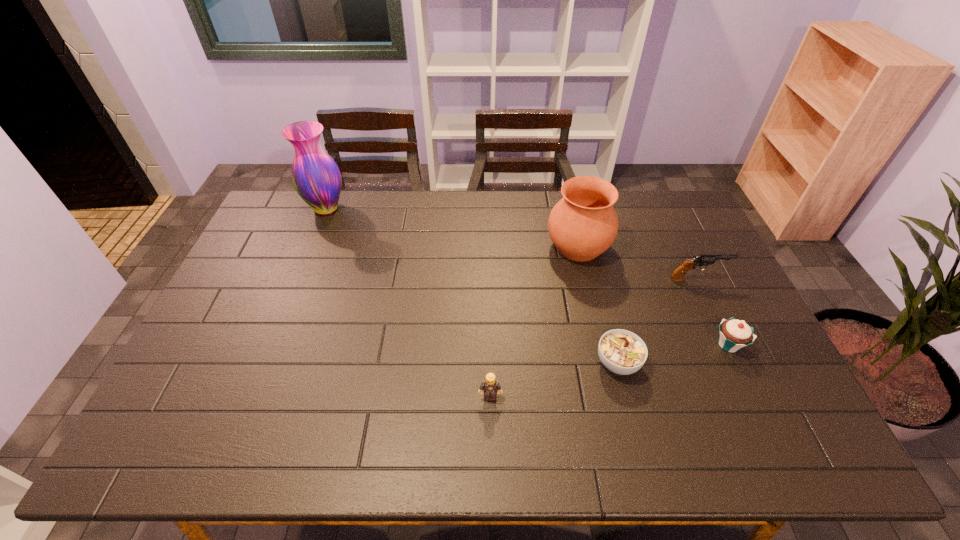
The width and height of the screenshot is (960, 540). What are the coordinates of `empty space that is in between the Lego and the cupcake` in the screenshot? It's located at (610, 370).

The image size is (960, 540). Identify the location of free space between the shortest object and the farthest object. (471, 286).

You are a GUI agent. You are given a task and a screenshot of the screen. Output one action in this format:
    pyautogui.click(x=<x>, y=<y>)
    Task: Click on the vacant space that is in between the tallest object and the gun
    
    Given the screenshot: What is the action you would take?
    pyautogui.click(x=512, y=244)

The height and width of the screenshot is (540, 960). Identify the location of vacant area that lies between the fifth nearest object and the shortest object. (598, 305).

This screenshot has height=540, width=960. I want to click on empty location between the soup bowl and the gun, so click(x=658, y=321).

Where is `free space that is in between the leftmost object and the cupcake`? free space that is in between the leftmost object and the cupcake is located at coordinates (527, 276).

At what (x,y) coordinates should I click in order to perform the action: click on free spot between the soup bowl and the cupcake. Please return your answer as a coordinate pair (x, y). The height and width of the screenshot is (540, 960). Looking at the image, I should click on (673, 354).

Locate an element on the screen. the closest object to the tallest object is located at coordinates (583, 224).

Find the location of `object that is the closest to the soup bowl`. object that is the closest to the soup bowl is located at coordinates (734, 334).

This screenshot has height=540, width=960. I want to click on free spot that satisfies the following two spatial constraints: 1. along the barrel of the third farthest object; 2. on the front side of the shortest object, so click(x=737, y=363).